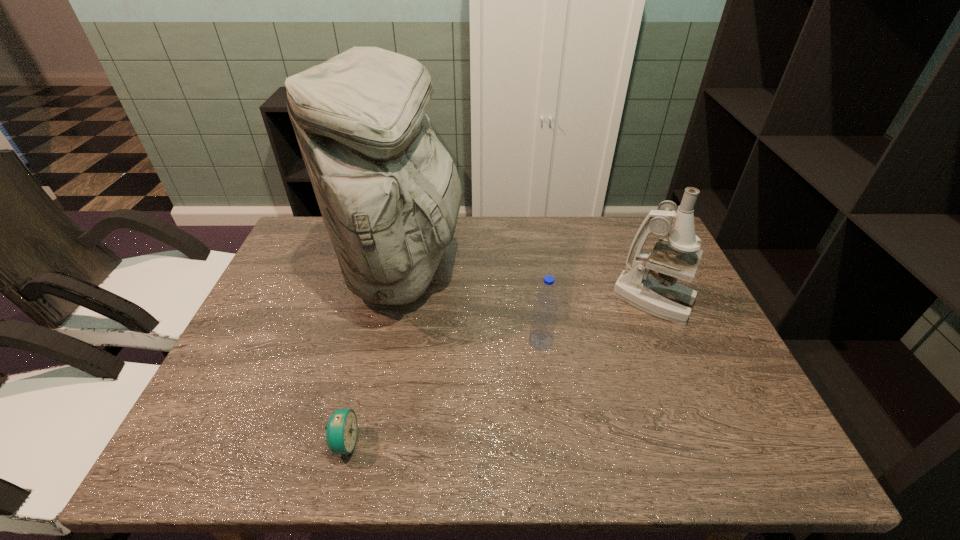
The height and width of the screenshot is (540, 960). I want to click on blank area located on the front-facing side of the alarm clock, so click(387, 443).

What are the coordinates of `object that is at the far edge` in the screenshot? It's located at (389, 193).

I want to click on object positioned at the near edge, so click(341, 431).

Where is `object present at the right edge`? object present at the right edge is located at coordinates (658, 294).

I want to click on vacant position at the far edge of the desktop, so click(x=537, y=228).

The image size is (960, 540). In order to click on vacant space at the near edge in this screenshot , I will do `click(539, 441)`.

In the image, there is a desktop. Where is `vacant space at the left edge`? vacant space at the left edge is located at coordinates (241, 339).

In the image, there is a desktop. Where is `blank space at the right edge`? This screenshot has height=540, width=960. blank space at the right edge is located at coordinates (653, 323).

The width and height of the screenshot is (960, 540). Find the location of `blank space at the far left corner`. blank space at the far left corner is located at coordinates (330, 255).

Image resolution: width=960 pixels, height=540 pixels. In order to click on vacant space that is in between the alarm clock and the water bottle in this screenshot , I will do pyautogui.click(x=443, y=393).